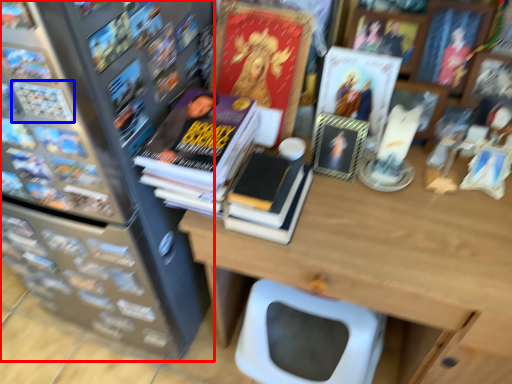
Question: Which of the following is the farthest to the observer, bookcase (highlighted by a red box) or book (highlighted by a blue box)?

Choices:
 (A) bookcase
 (B) book

Answer: (B)